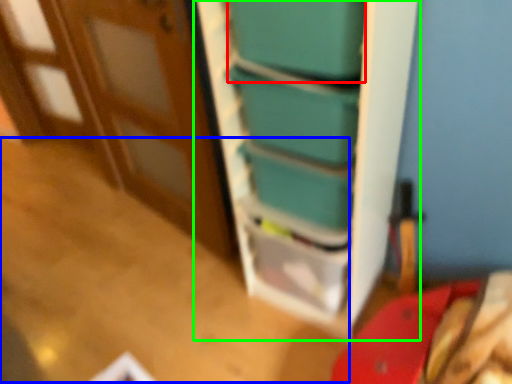
Question: Which object is positioned closest to box (highlighted by a red box)? Select from table (highlighted by a blue box) and bookshelf (highlighted by a green box).

Choices:
 (A) table
 (B) bookshelf

Answer: (B)